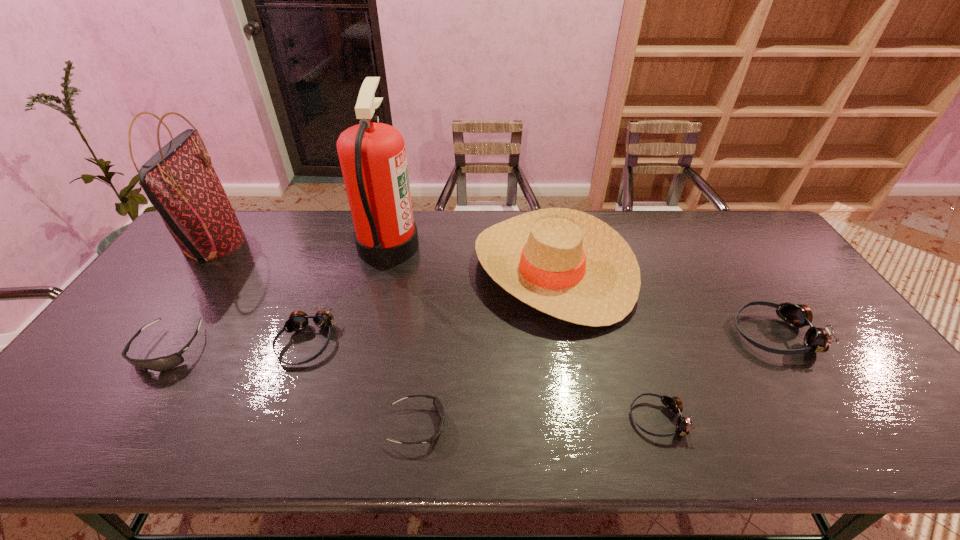
Find the location of `object that is at the right edge`. object that is at the right edge is located at coordinates (818, 340).

This screenshot has height=540, width=960. Identify the location of object at the far left corner. (179, 180).

Locate an element on the screen. The image size is (960, 540). free space at the far edge of the desktop is located at coordinates (337, 246).

Where is `free space at the near edge of the desktop`? free space at the near edge of the desktop is located at coordinates (261, 423).

You are a GUI agent. You are given a task and a screenshot of the screen. Output one action in this format:
    pyautogui.click(x=<x>, y=<y>)
    Task: Click on the vacant position at the right edge of the desktop
    
    Given the screenshot: What is the action you would take?
    pyautogui.click(x=775, y=264)

The width and height of the screenshot is (960, 540). Find the location of `vacant space at the far right corner of the desktop`. vacant space at the far right corner of the desktop is located at coordinates (749, 245).

Identify the location of vacant space in between the red fire extinguisher and the smallest bronze goggles. The width and height of the screenshot is (960, 540). coord(523,332).

You are a GUI agent. You are given a task and a screenshot of the screen. Output one action in this format:
    pyautogui.click(x=<x>, y=<y>)
    Task: Click on the unoccupied position between the second goggles from left to right and the left black goggles
    The width and height of the screenshot is (960, 540).
    Given the screenshot: What is the action you would take?
    pyautogui.click(x=237, y=346)

Find the location of a particular element. The height and width of the screenshot is (540, 960). free spot between the red fire extinguisher and the nearest bronze goggles is located at coordinates (523, 332).

In order to click on free spot between the handbag and the fourth tallest object in this screenshot , I will do `click(494, 288)`.